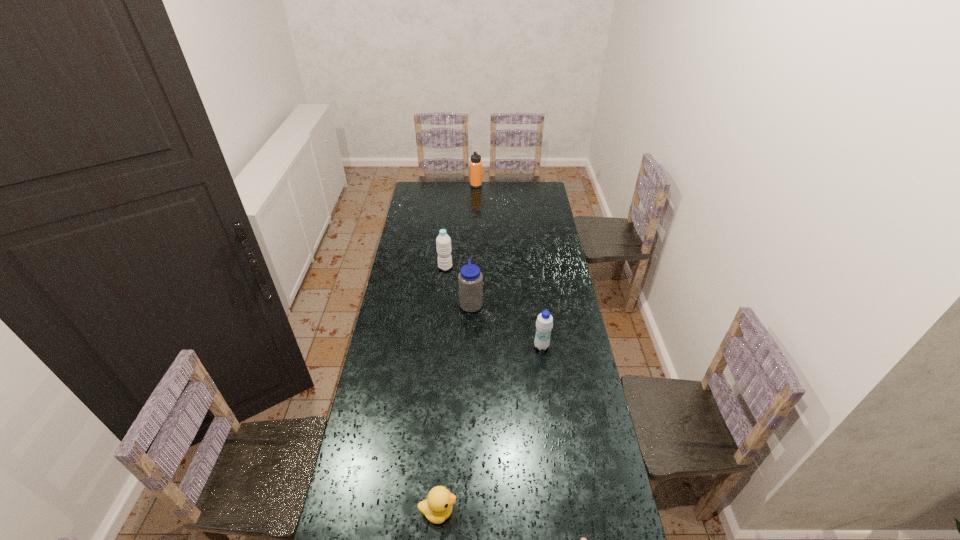
Image resolution: width=960 pixels, height=540 pixels. I want to click on vacant area situated 0.100m with a carrying loop on the side of the second water bottle from right to left, so click(504, 303).

The height and width of the screenshot is (540, 960). In order to click on vacant area situated 0.070m on the right of the nearest water bottle in this screenshot , I will do (566, 346).

This screenshot has width=960, height=540. What are the coordinates of `vacant space located on the face of the duck` in the screenshot? It's located at (566, 511).

This screenshot has height=540, width=960. What are the coordinates of `object located in the far edge section of the desktop` in the screenshot? It's located at (475, 164).

Identify the location of object situated at the right edge. The width and height of the screenshot is (960, 540). (544, 323).

Locate an element on the screen. The width and height of the screenshot is (960, 540). vacant space at the left edge is located at coordinates (419, 240).

Where is `vacant space at the right edge of the desktop`? The height and width of the screenshot is (540, 960). vacant space at the right edge of the desktop is located at coordinates (567, 445).

Identify the location of free spot between the nearest water bottle and the farthest object. (509, 266).

Where is `vacant region between the leftmost water bottle and the farthest object`? This screenshot has height=540, width=960. vacant region between the leftmost water bottle and the farthest object is located at coordinates (461, 226).

Locate an element on the screen. vacant area that lies between the second nearest object and the second farthest object is located at coordinates (442, 389).